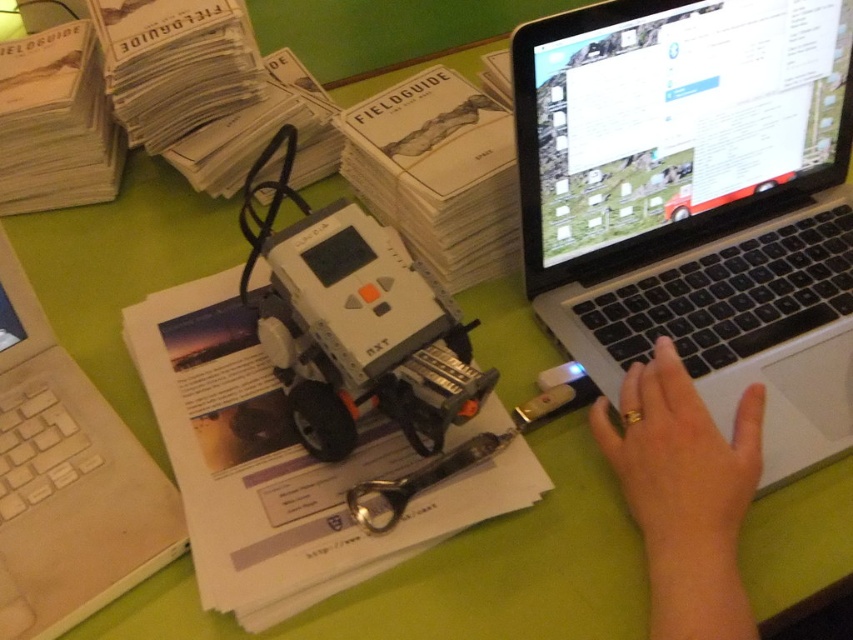
Between silver/black laptop at right and gold ring at lower right, which one has more height?

With more height is silver/black laptop at right.

Does silver/black laptop at right appear over gold ring at lower right?

Yes, silver/black laptop at right is above gold ring at lower right.

Find the location of `silver/black laptop at right`. silver/black laptop at right is located at coordinates (695, 202).

Is silver/black laptop at right further to the viewer compared to beige plastic laptop at lower left?

Yes.

Where is `silver/black laptop at right`? silver/black laptop at right is located at coordinates (695, 202).

Where is `silver/black laptop at right`? The image size is (853, 640). silver/black laptop at right is located at coordinates (695, 202).

Where is `silver/black laptop at right`? silver/black laptop at right is located at coordinates (695, 202).

Is point (229, 392) more distant than point (125, 486)?

Yes, point (229, 392) is farther from viewer.

Is white matte printer at center taller than beige plastic laptop at lower left?

In fact, white matte printer at center may be shorter than beige plastic laptop at lower left.

Between point (223, 560) and point (62, 380), which one is positioned in front?

Point (223, 560) is more forward.

Where is `white matte printer at center`? Image resolution: width=853 pixels, height=640 pixels. white matte printer at center is located at coordinates (282, 465).